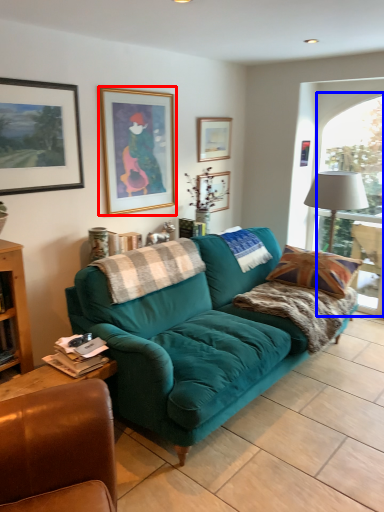
Question: Which object is closer to the camera taking this photo, picture frame (highlighted by a red box) or window (highlighted by a blue box)?

Choices:
 (A) picture frame
 (B) window

Answer: (A)